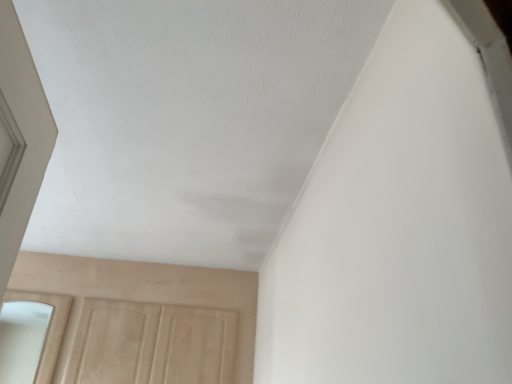
What do you see at coordinates (151, 344) in the screenshot? This screenshot has width=512, height=384. I see `beige wood screen door at lower left` at bounding box center [151, 344].

This screenshot has height=384, width=512. In order to click on beige wood screen door at lower left in this screenshot , I will do `click(151, 344)`.

What are the coordinates of `beige wood screen door at lower left` in the screenshot? It's located at (151, 344).